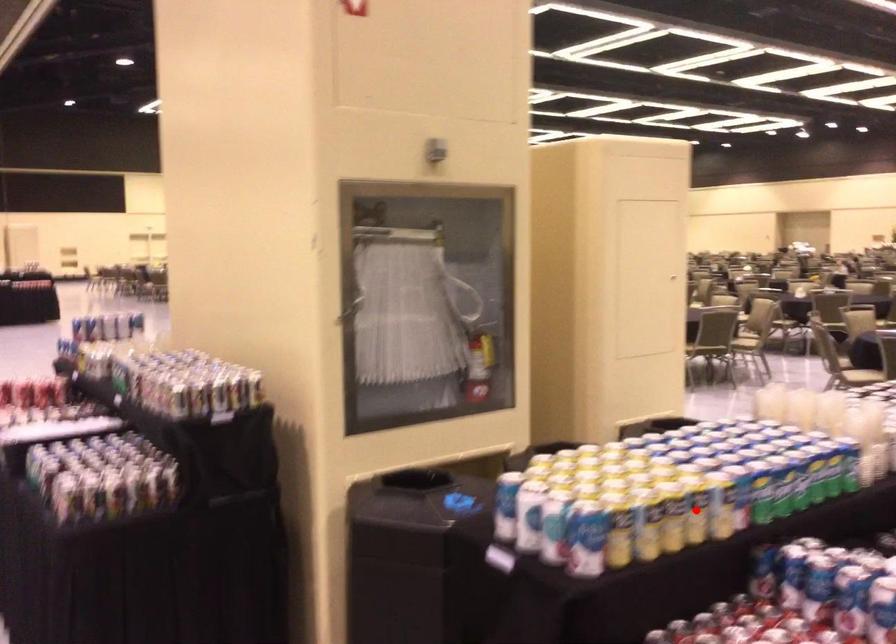
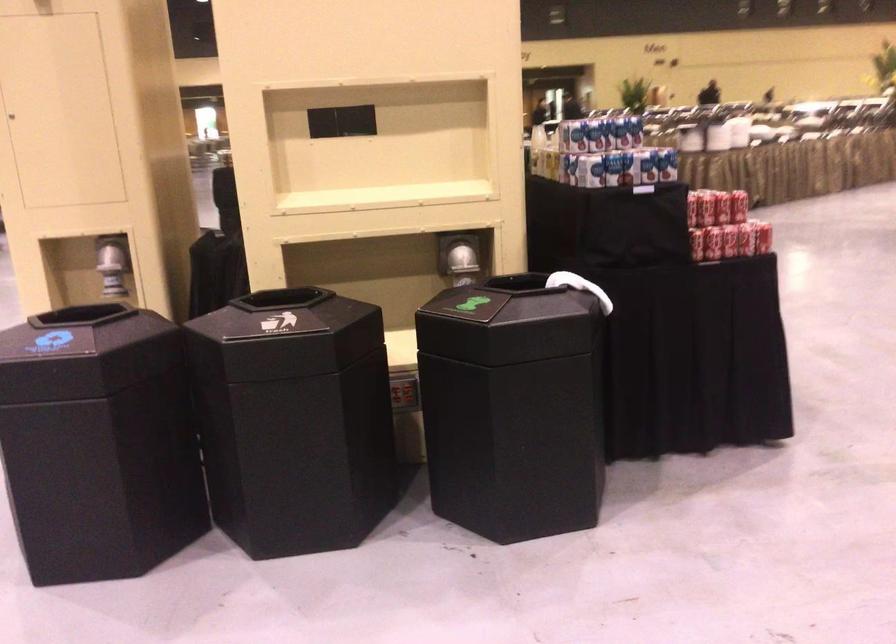
Question: I am providing you with two images of the same scene from different viewpoints. A red point is marked on the first image. At the location where the point appears in image 1, is it still visible in image 2?

Choices:
 (A) Yes
 (B) No

Answer: (B)